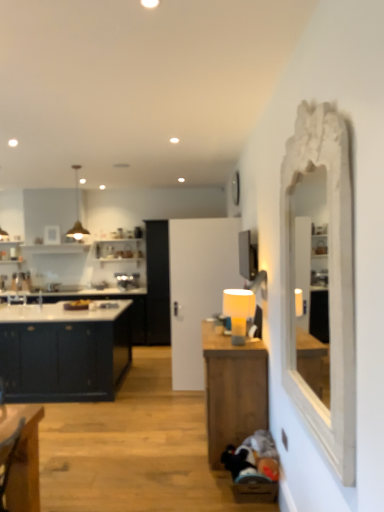
Question: Considering the relative positions of matte yellow lampshade at center-right and white carved mirror at right in the image provided, is matte yellow lampshade at center-right behind white carved mirror at right?

Choices:
 (A) yes
 (B) no

Answer: (A)

Question: From a real-world perspective, is matte yellow lampshade at center-right physically above white carved mirror at right?

Choices:
 (A) yes
 (B) no

Answer: (B)

Question: Is the surface of matte yellow lampshade at center-right in direct contact with white carved mirror at right?

Choices:
 (A) yes
 (B) no

Answer: (B)

Question: Does matte yellow lampshade at center-right have a larger size compared to white carved mirror at right?

Choices:
 (A) yes
 (B) no

Answer: (B)

Question: Is matte yellow lampshade at center-right completely or partially outside of white carved mirror at right?

Choices:
 (A) yes
 (B) no

Answer: (A)

Question: Looking at their shapes, would you say wooden table at center is wider or thinner than matte yellow lampshade at center-right?

Choices:
 (A) wide
 (B) thin

Answer: (A)

Question: Looking at the image, does wooden table at center seem bigger or smaller compared to matte yellow lampshade at center-right?

Choices:
 (A) small
 (B) big

Answer: (B)

Question: From a real-world perspective, is wooden table at center physically located above or below matte yellow lampshade at center-right?

Choices:
 (A) below
 (B) above

Answer: (A)

Question: From the image's perspective, is wooden table at center located above or below matte yellow lampshade at center-right?

Choices:
 (A) below
 (B) above

Answer: (A)

Question: Looking at their shapes, would you say white carved mirror at right is wider or thinner than matte yellow lampshade at center-right?

Choices:
 (A) thin
 (B) wide

Answer: (A)

Question: From a real-world perspective, relative to matte yellow lampshade at center-right, is white carved mirror at right vertically above or below?

Choices:
 (A) above
 (B) below

Answer: (A)

Question: Considering the positions of point (324, 291) and point (243, 303), is point (324, 291) closer or farther from the camera than point (243, 303)?

Choices:
 (A) farther
 (B) closer

Answer: (A)

Question: Is white carved mirror at right inside or outside of matte yellow lampshade at center-right?

Choices:
 (A) inside
 (B) outside

Answer: (B)

Question: Choose the correct answer: Is matte yellow lampshade at center-right inside matte dark blue cabinet at left or outside it?

Choices:
 (A) inside
 (B) outside

Answer: (B)

Question: From the image's perspective, is matte yellow lampshade at center-right positioned above or below matte dark blue cabinet at left?

Choices:
 (A) below
 (B) above

Answer: (B)